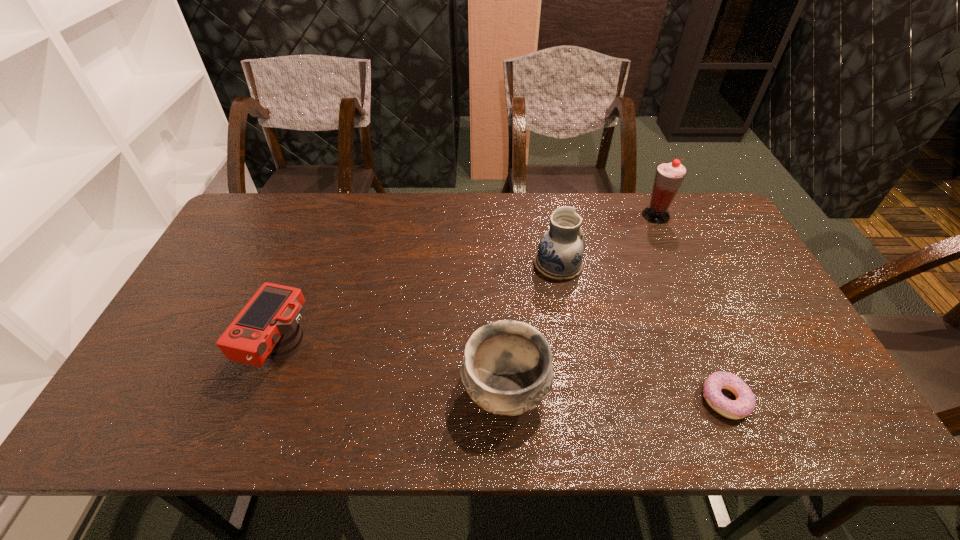
Where is `smoothie`? The image size is (960, 540). smoothie is located at coordinates (669, 176).

Identify the location of the farthest object. (669, 176).

The height and width of the screenshot is (540, 960). I want to click on the taller pottery, so click(560, 253).

This screenshot has width=960, height=540. In order to click on the right pottery in this screenshot , I will do `click(560, 253)`.

Where is `the second object from left to right`? the second object from left to right is located at coordinates (507, 369).

Where is `the shorter pottery`? The image size is (960, 540). the shorter pottery is located at coordinates (507, 369).

Where is `the leftmost object`? This screenshot has width=960, height=540. the leftmost object is located at coordinates 268,326.

This screenshot has width=960, height=540. Identify the location of doughnut. (744, 404).

The width and height of the screenshot is (960, 540). In order to click on vacant space located 0.080m on the right of the smoothie in this screenshot , I will do `click(693, 215)`.

Locate an element on the screen. The height and width of the screenshot is (540, 960). vacant space situated 0.100m on the front of the fourth nearest object is located at coordinates (566, 308).